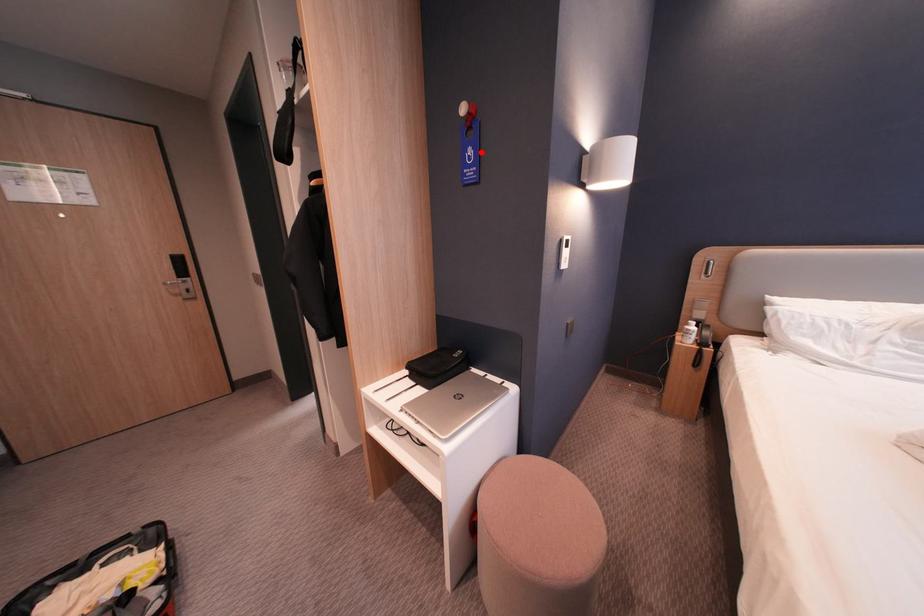
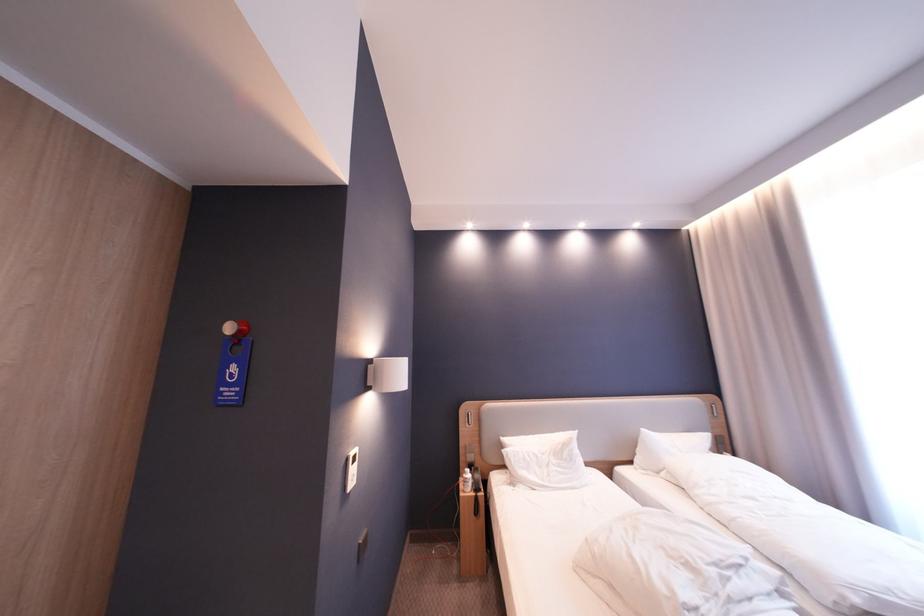
Where in the second image is the point corresponding to the highlighted location from the first image?

(245, 370)